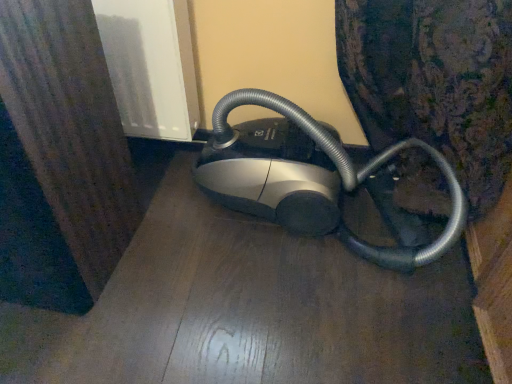
The image size is (512, 384). Describe the element at coordinates (310, 178) in the screenshot. I see `silver metallic vacuum cleaner at center` at that location.

Identify the location of silver metallic vacuum cleaner at center. (310, 178).

The height and width of the screenshot is (384, 512). Find the location of `silver metallic vacuum cleaner at center`. silver metallic vacuum cleaner at center is located at coordinates (310, 178).